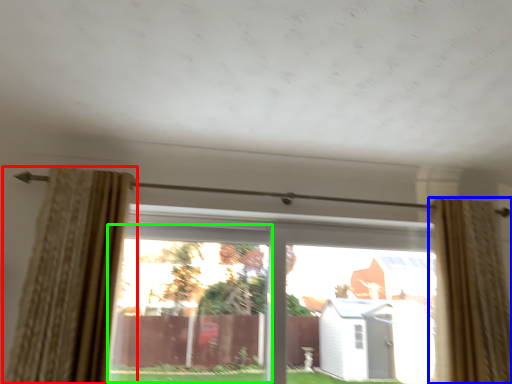
Question: Which is nearer to the curtain (highlighted by a red box)? curtain (highlighted by a blue box) or window (highlighted by a green box).

Choices:
 (A) curtain
 (B) window

Answer: (B)